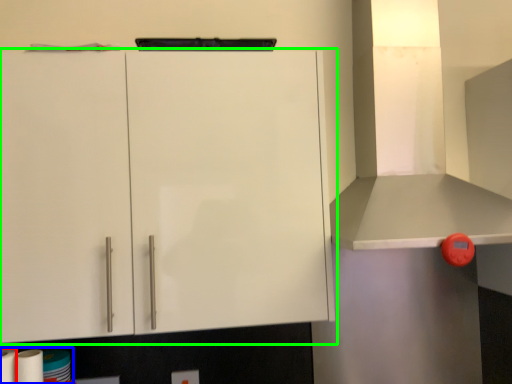
Question: Which is farther away from paper towel (highlighted by a red box)? toilet paper (highlighted by a blue box) or cabinetry (highlighted by a green box)?

Choices:
 (A) toilet paper
 (B) cabinetry

Answer: (B)